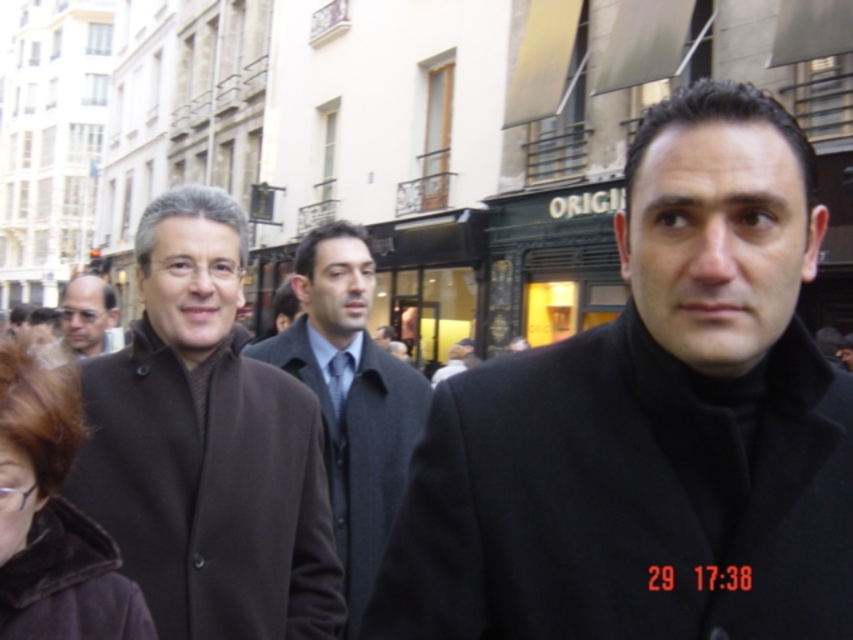
Question: Is black wool coat at center above dark brown fur coat at lower left?

Choices:
 (A) no
 (B) yes

Answer: (B)

Question: Based on their relative distances, which object is nearer to the matte black coat at left?

Choices:
 (A) black wool coat at center
 (B) brown wool coat at center

Answer: (B)

Question: Which object is positioned farthest from the black wool coat at center?

Choices:
 (A) dark brown fur coat at left
 (B) dark gray wool coat at center
 (C) brown wool coat at center
 (D) dark brown fur coat at lower left

Answer: (B)

Question: Which object appears farthest from the camera in this image?

Choices:
 (A) dark brown fur coat at left
 (B) dark brown fur coat at lower left
 (C) black wool coat at center
 (D) matte black coat at left

Answer: (D)

Question: Is brown wool coat at center thinner than dark gray wool coat at center?

Choices:
 (A) yes
 (B) no

Answer: (A)

Question: Does black wool coat at center appear over matte black coat at left?

Choices:
 (A) yes
 (B) no

Answer: (B)